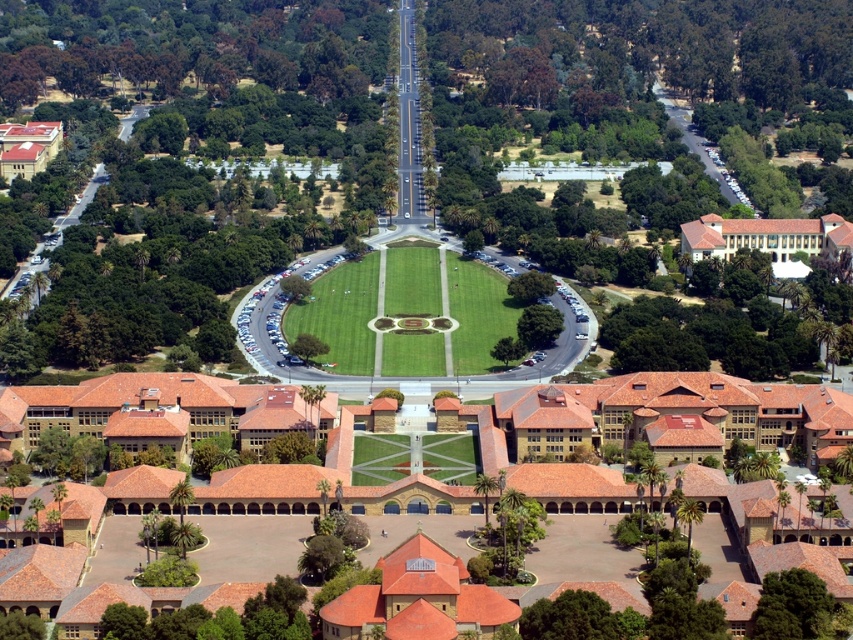
Question: Does green grassy field at center have a greater width compared to green leafy tree at lower left?

Choices:
 (A) no
 (B) yes

Answer: (B)

Question: Is green grassy field at center to the left of green leafy tree at lower right from the viewer's perspective?

Choices:
 (A) no
 (B) yes

Answer: (B)

Question: Which object appears farthest from the camera in this image?

Choices:
 (A) green leafy tree at lower left
 (B) green leafy tree at lower right
 (C) green leafy tree at center
 (D) green grassy field at center

Answer: (C)

Question: Among these points, which one is nearest to the camera?

Choices:
 (A) coord(305,339)
 (B) coord(189,531)

Answer: (B)

Question: Does green leafy tree at lower right appear under green leafy tree at lower left?

Choices:
 (A) no
 (B) yes

Answer: (B)

Question: Which object appears farthest from the camera in this image?

Choices:
 (A) green grassy field at center
 (B) green leafy tree at lower right
 (C) green leafy tree at center

Answer: (C)